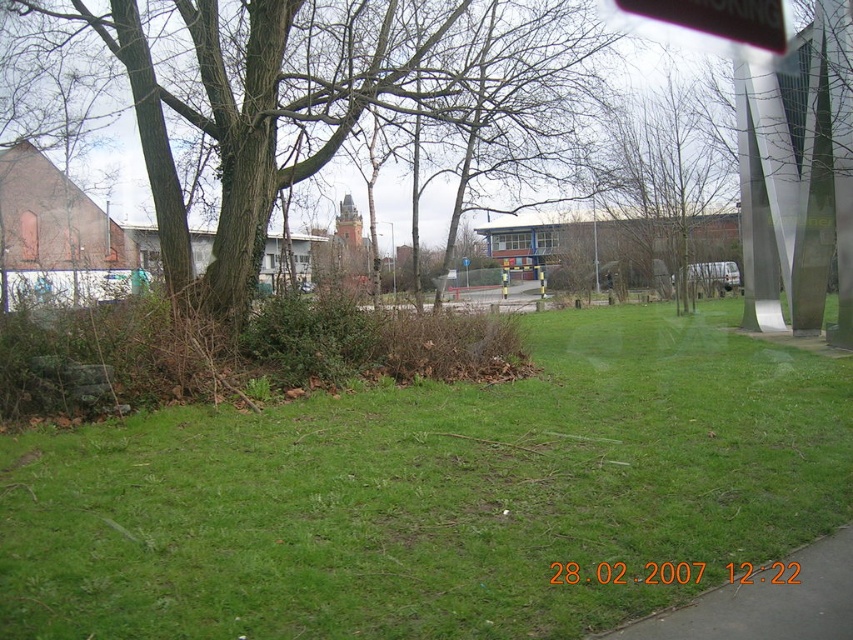
Question: Does green grass at center appear over brown rough bark tree at left?

Choices:
 (A) no
 (B) yes

Answer: (A)

Question: Which point is closer to the camera?

Choices:
 (A) brown rough bark tree at left
 (B) green grass at center

Answer: (B)

Question: Which point appears closest to the camera in this image?

Choices:
 (A) (717, 32)
 (B) (434, 476)
 (C) (292, 129)

Answer: (B)

Question: Which of the following is the farthest from the observer?

Choices:
 (A) brown rough bark tree at left
 (B) black plastic sign at upper center
 (C) green grass at center

Answer: (B)

Question: Is green grass at center positioned before brown rough bark tree at left?

Choices:
 (A) yes
 (B) no

Answer: (A)

Question: Can you confirm if green grass at center is bigger than brown rough bark tree at left?

Choices:
 (A) no
 (B) yes

Answer: (A)